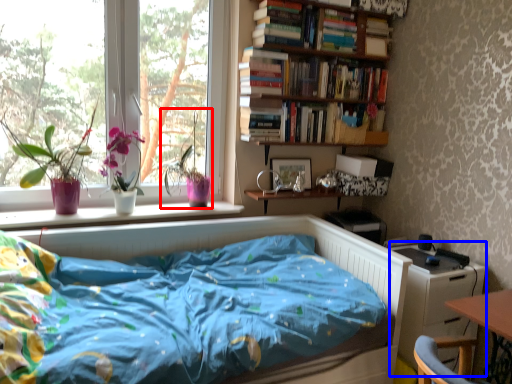
Question: Which point is closer to the camera, floral arrangement (highlighted by a red box) or dresser (highlighted by a blue box)?

Choices:
 (A) floral arrangement
 (B) dresser

Answer: (B)